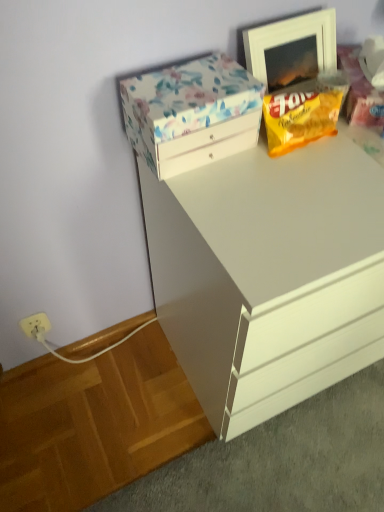
This screenshot has width=384, height=512. What are the coordinates of `free space in front of white wooden picture frame at upper right` in the screenshot? It's located at (318, 158).